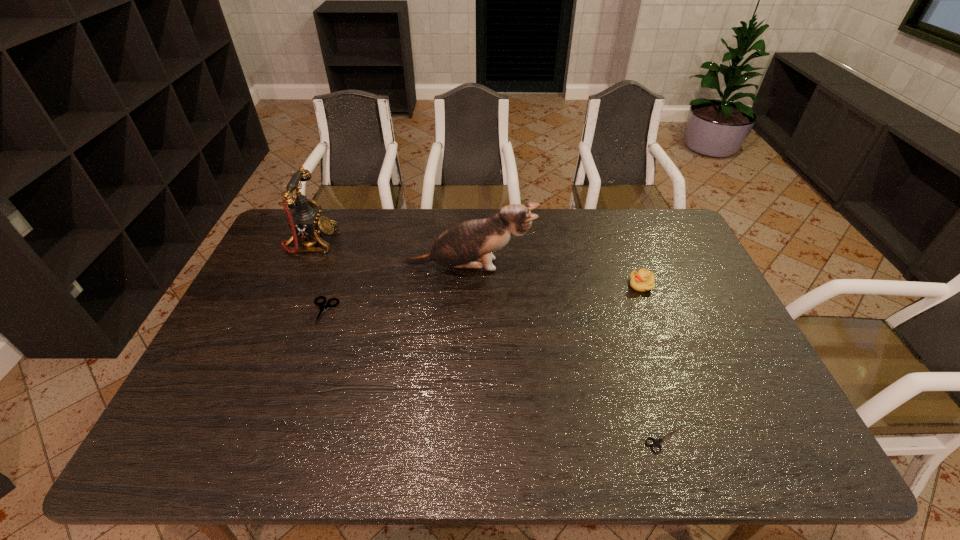
The height and width of the screenshot is (540, 960). Identify the location of free space at the left edge of the desktop. (236, 368).

Locate an element on the screen. The width and height of the screenshot is (960, 540). vacant point at the right edge is located at coordinates (678, 302).

Where is `free space at the near left corner of the desktop`? free space at the near left corner of the desktop is located at coordinates (188, 448).

The image size is (960, 540). Find the location of `free space between the duckling and the left shears`. free space between the duckling and the left shears is located at coordinates (483, 298).

Where is `vacant region between the telephone and the third object from left to right`? Image resolution: width=960 pixels, height=540 pixels. vacant region between the telephone and the third object from left to right is located at coordinates (x=391, y=254).

Locate an element on the screen. Image resolution: width=960 pixels, height=540 pixels. free space between the second shortest object and the nearest object is located at coordinates (494, 375).

Identify the location of free spot between the second nearest object and the shortest object. (494, 375).

I want to click on free point between the telephone and the right shears, so click(x=489, y=341).

Find the location of a particular element. empty space that is in between the taller shears and the duckling is located at coordinates pyautogui.click(x=483, y=298).

You are a GUI agent. You are given a task and a screenshot of the screen. Output one action in this format:
    pyautogui.click(x=<x>, y=<y>)
    Task: Click on the free point between the third object from right to left and the leftmost object
    Image resolution: width=960 pixels, height=540 pixels.
    Given the screenshot: What is the action you would take?
    pyautogui.click(x=391, y=254)